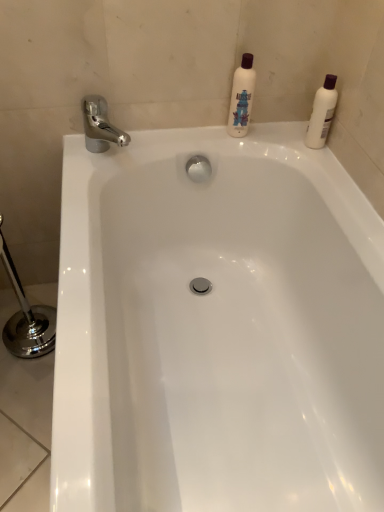
This screenshot has height=512, width=384. I want to click on empty space that is in between white matte bottle at upper center, which is the 1th cleaning product in left-to-right order, and white plastic bottle at upper right, which is the 2th cleaning product from left to right, so click(x=279, y=136).